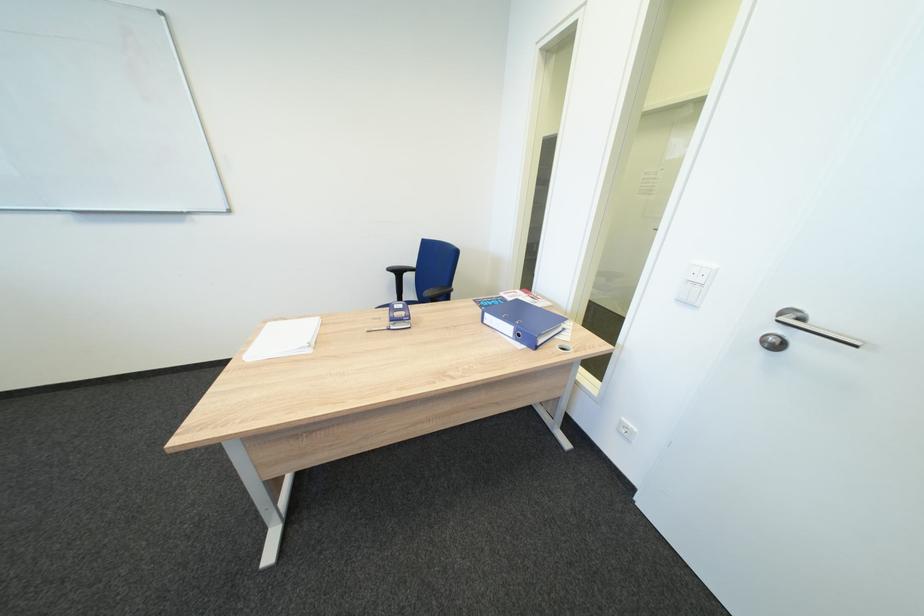
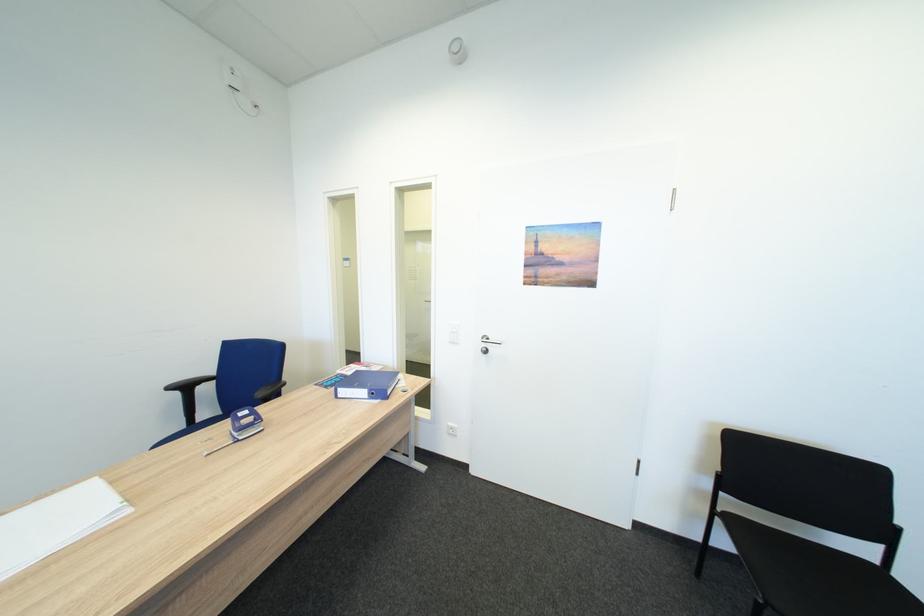
Question: Based on the continuous images, in which direction is the camera rotating? Reply with the corresponding letter.

Choices:
 (A) Left
 (B) Right
 (C) Up
 (D) Down

Answer: (B)